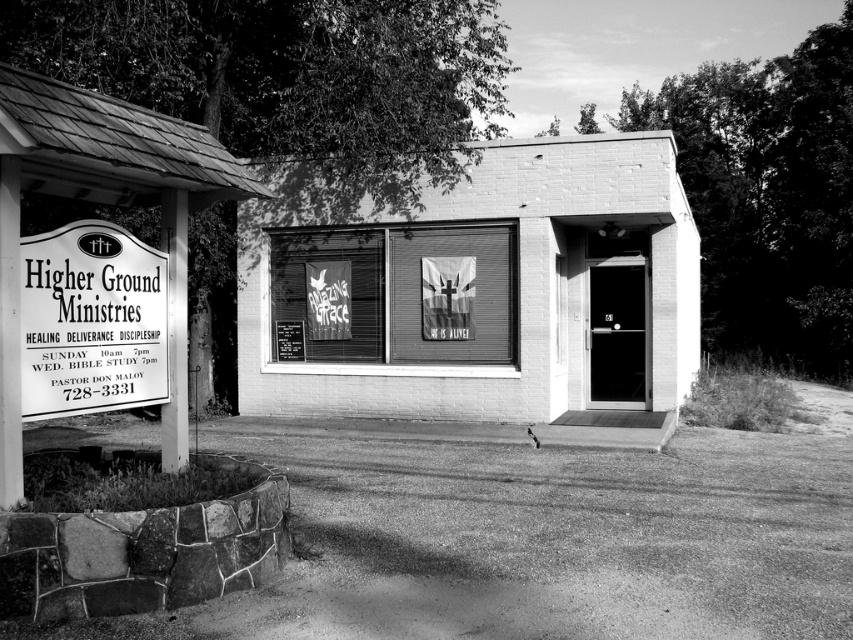
Question: Which of the following is the farthest from the observer?

Choices:
 (A) (148, 312)
 (B) (645, 426)

Answer: (B)

Question: Is white brick building at center bigger than metallic signboard at left?

Choices:
 (A) no
 (B) yes

Answer: (B)

Question: In this image, where is white brick building at center located relative to metallic signboard at left?

Choices:
 (A) left
 (B) right

Answer: (B)

Question: Does white brick building at center appear on the left side of metallic signboard at left?

Choices:
 (A) yes
 (B) no

Answer: (B)

Question: Which object is closer to the camera taking this photo?

Choices:
 (A) white brick building at center
 (B) metallic signboard at left

Answer: (B)

Question: Which point is closer to the camera?

Choices:
 (A) metallic signboard at left
 (B) white brick building at center

Answer: (A)